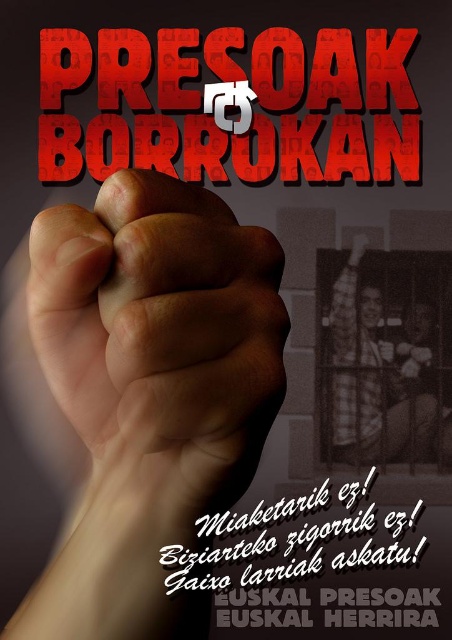
Is smooth skin fist at center in front of white paper text at center?

That is True.

Is point (61, 237) positioned in front of point (241, 570)?

Yes, point (61, 237) is closer to viewer.

Who is more forward, (182, 268) or (253, 563)?

Point (182, 268)

You are a GUI agent. You are given a task and a screenshot of the screen. Output one action in this format:
    pyautogui.click(x=<x>, y=<y>)
    Task: Click on the smooth skin fist at center
    This screenshot has width=452, height=640.
    Given the screenshot: What is the action you would take?
    pyautogui.click(x=161, y=326)

Measure the distance from red textured paper at center to white paper text at center.

1.07 meters

Which of these two, red textured paper at center or white paper text at center, stands taller?

white paper text at center

Is point (169, 122) farther from camera compared to point (417, 564)?

That is True.

In order to click on red textured paper at center in this screenshot , I will do `click(202, 106)`.

Does smooth skin fist at center appear on the right side of red textured paper at center?

In fact, smooth skin fist at center is to the left of red textured paper at center.

Who is lower down, smooth skin fist at center or red textured paper at center?

smooth skin fist at center is lower down.

Find the location of a particular element. This screenshot has width=452, height=640. smooth skin fist at center is located at coordinates (161, 326).

The width and height of the screenshot is (452, 640). I want to click on smooth skin fist at center, so click(x=161, y=326).